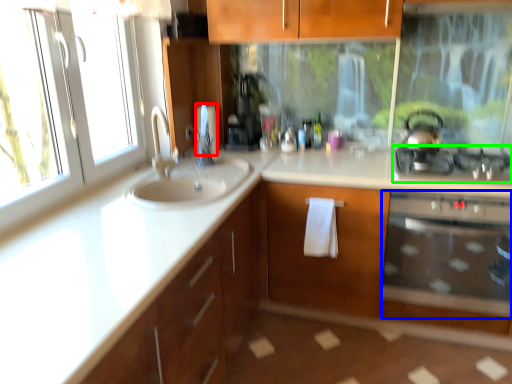
Question: Based on their relative distances, which object is nearer to toilet paper (highlighted by a red box)? Choose from oven (highlighted by a blue box) and gas stove (highlighted by a green box).

Choices:
 (A) oven
 (B) gas stove

Answer: (B)